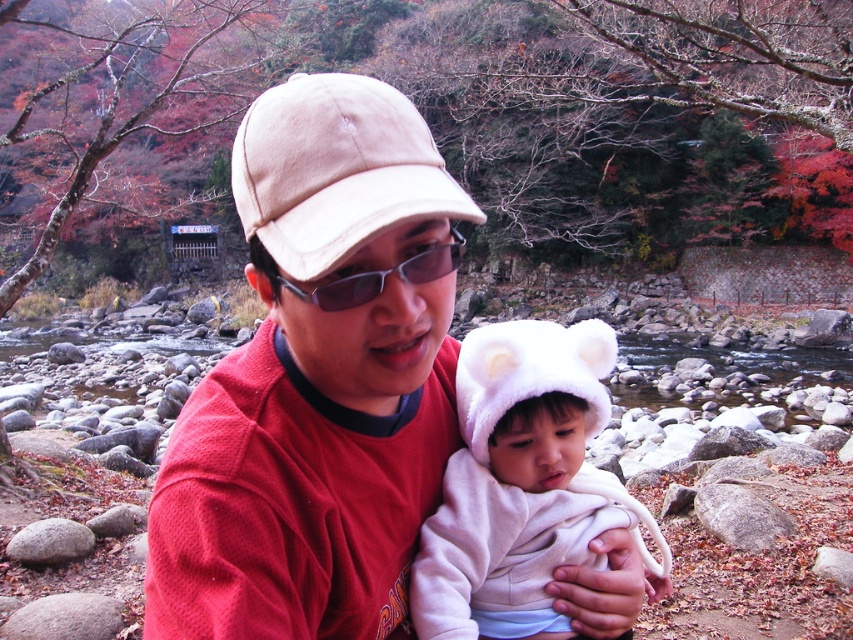
What is the exact location of the beige suede cap at center in the image?

The beige suede cap at center is located at point coordinates of 0.266 on the x axis and 0.394 on the y axis.

Looking at this image, you are a photographer trying to capture a photo of the two objects at the center of the image. The matte red shirt at center and the white fluffy hat at center. Since you want to ensure both are in focus, you need to know their positions relative to each other. Which object is positioned to the left of the other?

The matte red shirt at center is to the left of the white fluffy hat at center.